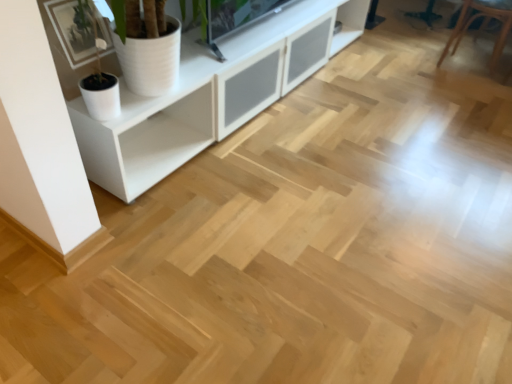
Image resolution: width=512 pixels, height=384 pixels. What are the coordinates of `vacant space to the left of brown leather armchair at upper right` in the screenshot? It's located at (404, 56).